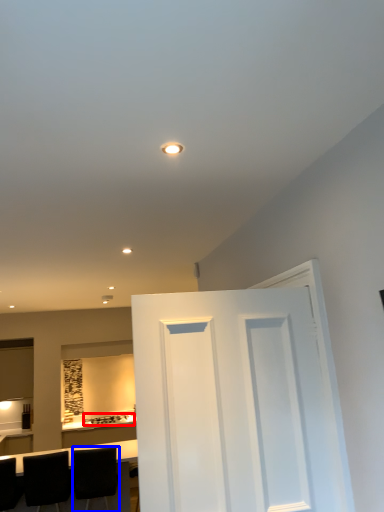
Question: Which object is closer to the camera taking this photo, appliance (highlighted by a red box) or chair (highlighted by a blue box)?

Choices:
 (A) appliance
 (B) chair

Answer: (B)